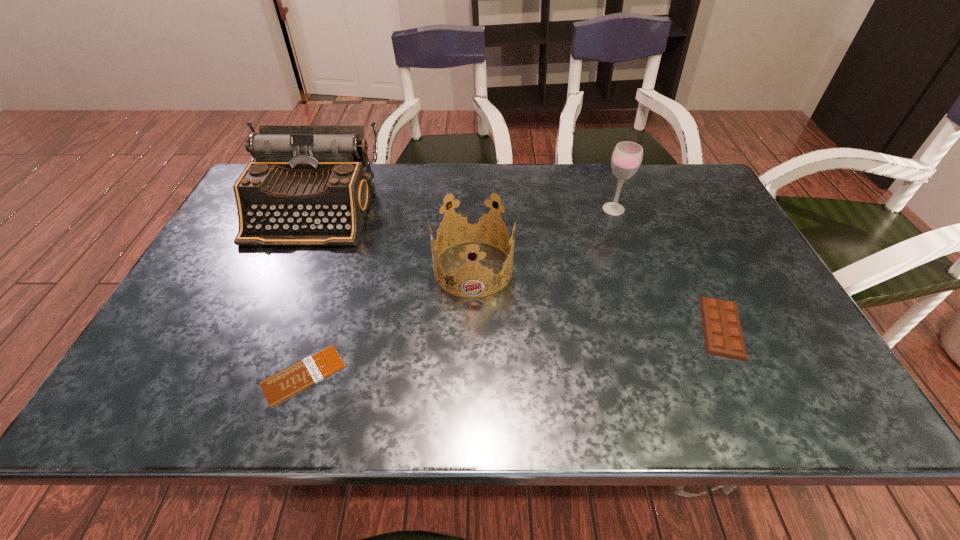
Where is `wineglass`? The image size is (960, 540). wineglass is located at coordinates (627, 156).

At what (x,y) coordinates should I click in order to perform the action: click on typewriter. Please return your answer as a coordinate pair (x, y). Looking at the image, I should click on (310, 185).

This screenshot has height=540, width=960. Identify the location of crown. (467, 270).

This screenshot has height=540, width=960. Identify the location of the right chocolate bar. (723, 336).

Find the location of a particular element. Image resolution: width=960 pixels, height=540 pixels. the taller chocolate bar is located at coordinates (723, 336).

Locate an element on the screen. the shortest object is located at coordinates (288, 382).

Locate an element on the screen. The image size is (960, 540). the left chocolate bar is located at coordinates (288, 382).

The height and width of the screenshot is (540, 960). I want to click on blank space located on the front of the second object from right to left, so click(653, 323).

Where is `vacant space situated 0.220m on the keyboard of the typewriter`? The width and height of the screenshot is (960, 540). vacant space situated 0.220m on the keyboard of the typewriter is located at coordinates (269, 311).

Locate an element on the screen. The image size is (960, 540). vacant space located on the right of the crown is located at coordinates (668, 268).